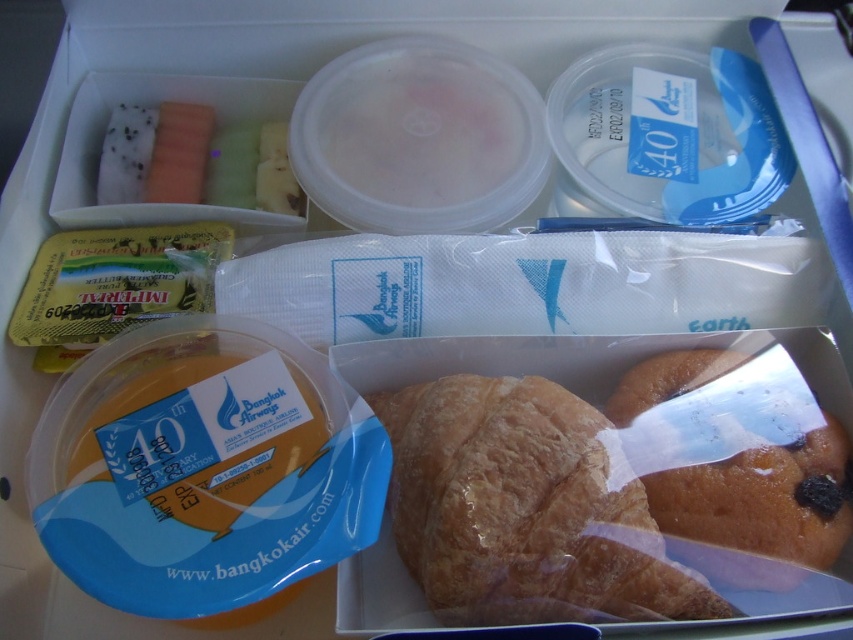
Question: Is golden brown flaky croissant at center closer to camera compared to golden brown flaky croissant at lower right?

Choices:
 (A) yes
 (B) no

Answer: (A)

Question: Does golden brown flaky croissant at center appear over golden brown flaky croissant at lower right?

Choices:
 (A) no
 (B) yes

Answer: (A)

Question: Among these objects, which one is farthest from the camera?

Choices:
 (A) golden brown flaky croissant at lower right
 (B) golden brown flaky croissant at center

Answer: (A)

Question: Can you confirm if golden brown flaky croissant at center is bigger than golden brown flaky croissant at lower right?

Choices:
 (A) yes
 (B) no

Answer: (A)

Question: Among these points, which one is farthest from the camera?

Choices:
 (A) (457, 474)
 (B) (730, 502)

Answer: (B)